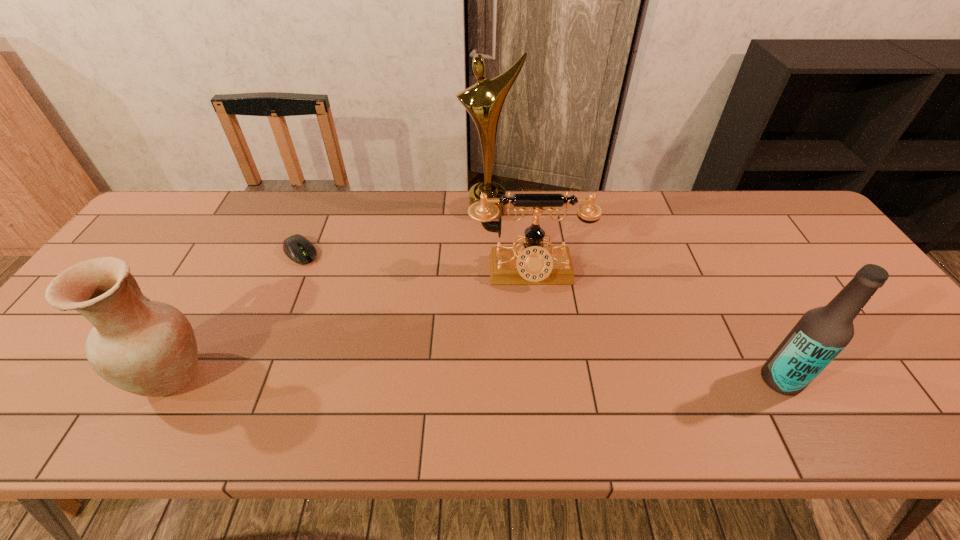
Image resolution: width=960 pixels, height=540 pixels. Find the location of `computer mouse that is at the far edge`. computer mouse that is at the far edge is located at coordinates (300, 250).

This screenshot has height=540, width=960. I want to click on award at the far edge, so click(x=484, y=101).

Image resolution: width=960 pixels, height=540 pixels. In order to click on pottery present at the near edge in this screenshot , I will do `click(148, 348)`.

Locate an element on the screen. beer bottle that is at the near edge is located at coordinates click(x=822, y=333).

In the image, there is a desktop. Identify the location of vacant space at the far edge. [300, 221].

Identify the location of vacant space at the near edge of the desktop. (274, 366).

Locate an element on the screen. The image size is (960, 540). blank space at the left edge of the desktop is located at coordinates (136, 243).

The image size is (960, 540). What are the coordinates of `vacant space at the right edge of the desktop` in the screenshot? It's located at (890, 360).

At what (x,y) coordinates should I click in order to perform the action: click on free spot at the far right corner of the desktop. Please return your answer as a coordinate pair (x, y). Looking at the image, I should click on (746, 195).

The height and width of the screenshot is (540, 960). I want to click on free space between the pottery and the second object from left to right, so click(237, 314).